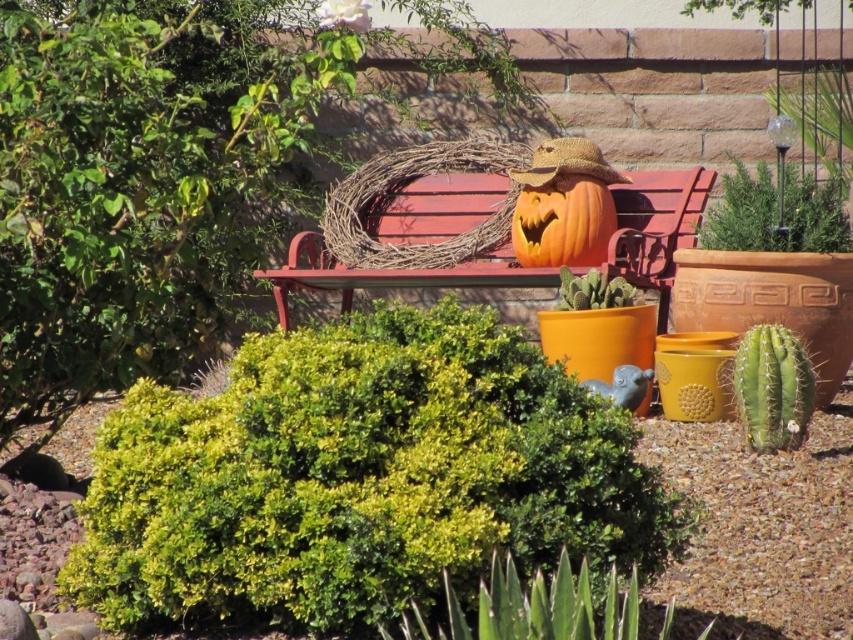
Question: Estimate the real-world distances between objects in this image. Which object is closer to the orange matte pumpkin at center?

Choices:
 (A) green leafy bush at center
 (B) wooden bench at center

Answer: (B)

Question: Can you confirm if green leafy bush at center is positioned to the right of orange matte pumpkin at center?

Choices:
 (A) no
 (B) yes

Answer: (A)

Question: Which of the following is the closest to the observer?

Choices:
 (A) green leafy bush at center
 (B) wooden bench at center
 (C) orange matte pumpkin at center

Answer: (A)

Question: Is green leafy bush at center closer to the viewer compared to wooden bench at center?

Choices:
 (A) no
 (B) yes

Answer: (B)

Question: Which object is closer to the camera taking this photo?

Choices:
 (A) wooden bench at center
 (B) green leafy bush at center

Answer: (B)

Question: Is green leafy bush at center positioned at the back of wooden bench at center?

Choices:
 (A) no
 (B) yes

Answer: (A)